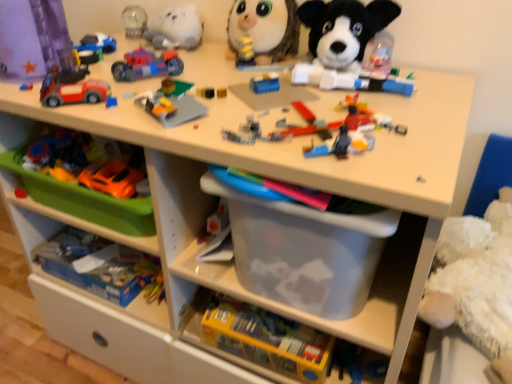
The width and height of the screenshot is (512, 384). What are the coordinates of `vacant area that lies between translucent plastic bricks at center, arranged as the 6th toy when viewed from the top, and soft plush dog at upper center, which is the 3th toy in top-to-bottom order` in the screenshot? It's located at (353, 93).